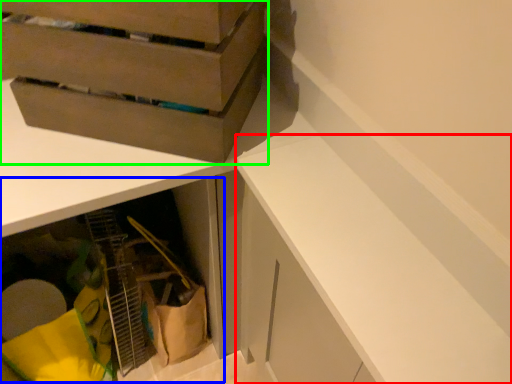
Question: Estimate the real-world distances between objects in this image. Which object is farther from cabinetry (highlighted by a red box), cabinetry (highlighted by a blue box) or cardboard box (highlighted by a green box)?

Choices:
 (A) cabinetry
 (B) cardboard box

Answer: (A)